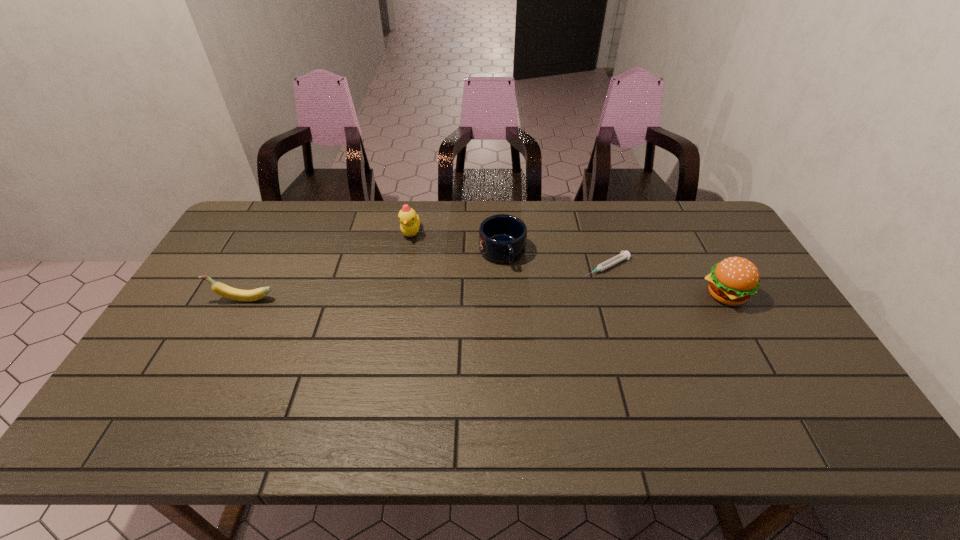
Locate an element on the screen. The height and width of the screenshot is (540, 960). free space between the third object from right to left and the rightmost object is located at coordinates pos(614,274).

Where is `vacant space that's between the syringe and the hamburger`? Image resolution: width=960 pixels, height=540 pixels. vacant space that's between the syringe and the hamburger is located at coordinates (666, 281).

The image size is (960, 540). In order to click on vacant point located between the duckling and the rightmost object in this screenshot , I will do 568,264.

Where is `free space that is in between the mug and the syringe`? free space that is in between the mug and the syringe is located at coordinates coord(555,260).

Locate an element on the screen. The width and height of the screenshot is (960, 540). unoccupied area between the second object from left to right and the banana is located at coordinates (327, 266).

Locate which object ranks second in proximity to the banana. Please provide its 2D coordinates. Your answer should be formatted as a tuple, i.e. [(x, y)], where the tuple contains the x and y coordinates of a point satisfying the conditions above.

[(502, 238)]

Image resolution: width=960 pixels, height=540 pixels. I want to click on the third closest object to the duckling, so click(623, 255).

Locate an element on the screen. The width and height of the screenshot is (960, 540). vacant position in the image that satisfies the following two spatial constraints: 1. on the front side of the rightmost object; 2. on the left side of the fourth object from left to right is located at coordinates (615, 295).

Find the location of a particular element. The image size is (960, 540). vacant position in the image that satisfies the following two spatial constraints: 1. on the front side of the duckling; 2. on the left side of the third object from right to left is located at coordinates (408, 252).

Find the location of a particular element. free space in the image that satisfies the following two spatial constraints: 1. on the front side of the syringe; 2. on the left side of the duckling is located at coordinates (405, 267).